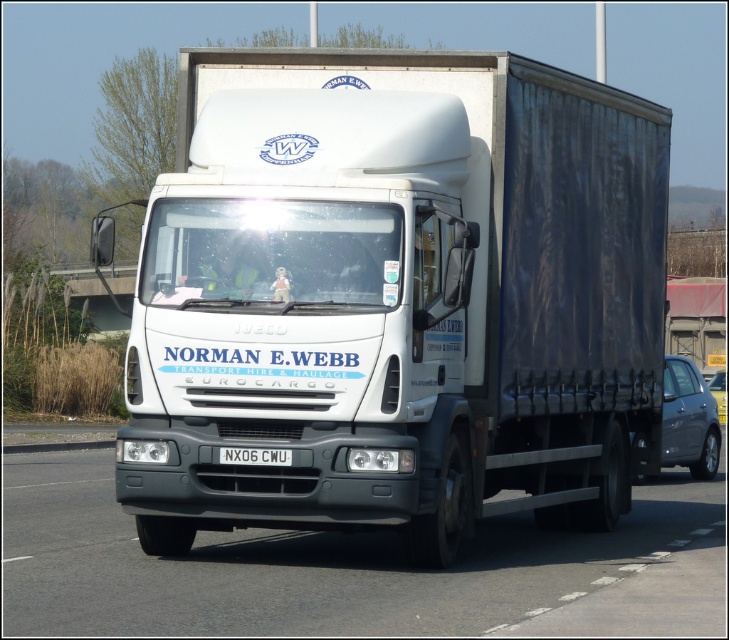
Question: Observing the image, what is the correct spatial positioning of white plastic license plate at center in reference to metallic silver car at right?

Choices:
 (A) below
 (B) above

Answer: (B)

Question: Can you confirm if white glossy truck at center is positioned below metallic silver car at right?

Choices:
 (A) no
 (B) yes

Answer: (B)

Question: Considering the real-world distances, which object is closest to the white glossy truck at center?

Choices:
 (A) metallic silver car at right
 (B) white plastic license plate at center

Answer: (B)

Question: Which is farther from the white glossy truck at center?

Choices:
 (A) satin grey car at right
 (B) metallic silver car at right
 (C) white matte trailer truck at center
 (D) white plastic license plate at center

Answer: (B)

Question: Can you confirm if white plastic license plate at center is positioned below metallic silver car at right?

Choices:
 (A) no
 (B) yes

Answer: (A)

Question: Which point is closer to the camera?

Choices:
 (A) satin grey car at right
 (B) metallic silver car at right
 (C) white matte trailer truck at center
 (D) white plastic license plate at center

Answer: (D)